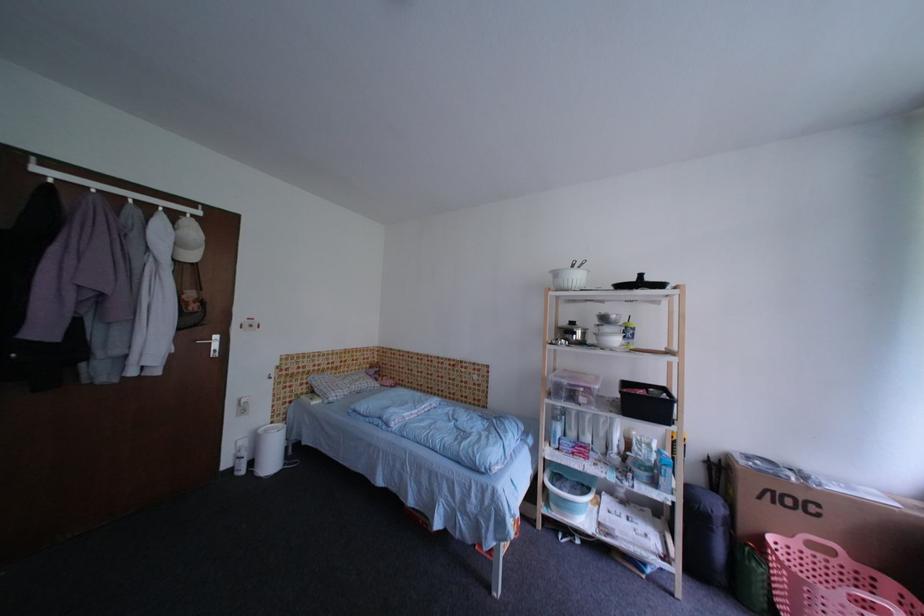
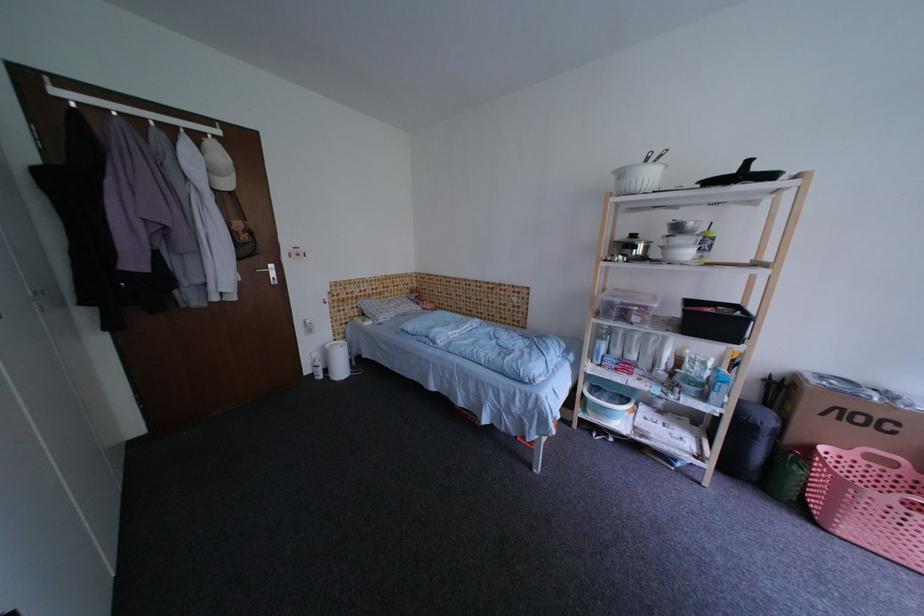
Where in the second image is the point corresponding to point 201,233 from the first image?

(227, 158)